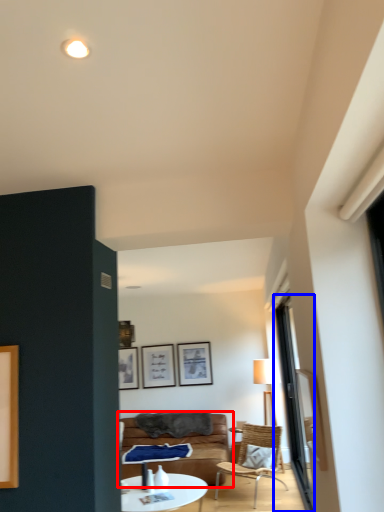
Question: Which object is closer to the camera taking this photo, studio couch (highlighted by a red box) or window (highlighted by a blue box)?

Choices:
 (A) studio couch
 (B) window

Answer: (B)